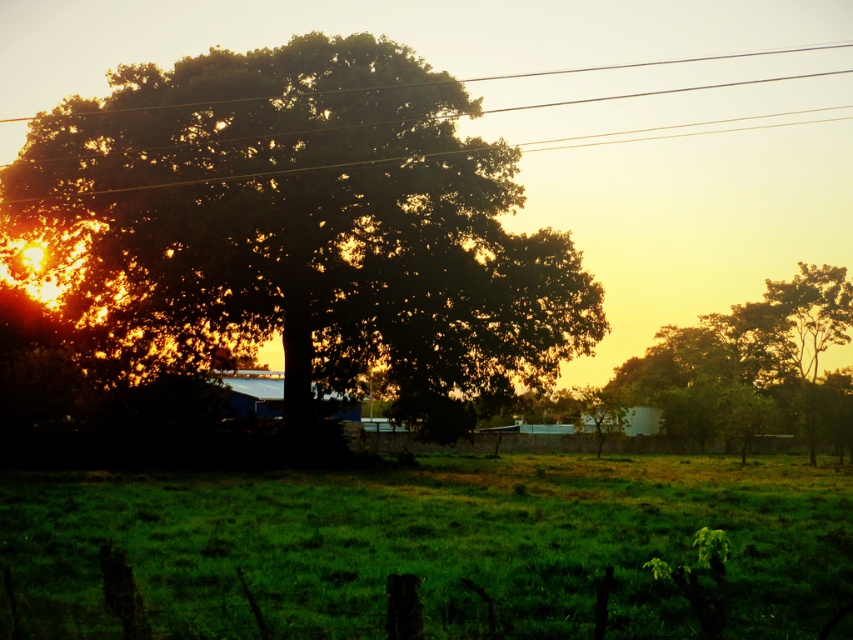
Question: Can you confirm if green grassy field at center is smaller than green leafy tree at right?

Choices:
 (A) no
 (B) yes

Answer: (B)

Question: Which of the following is the farthest from the observer?

Choices:
 (A) green leafy tree at center
 (B) green grassy field at center
 (C) metallic wires at upper center

Answer: (C)

Question: Can you confirm if green grassy field at center is positioned below metallic wires at upper center?

Choices:
 (A) no
 (B) yes

Answer: (B)

Question: Which object appears closest to the camera in this image?

Choices:
 (A) green grassy field at center
 (B) metallic wires at upper center

Answer: (A)

Question: Considering the real-world distances, which object is closest to the metallic wires at upper center?

Choices:
 (A) green leafy tree at right
 (B) green leafy tree at center
 (C) green grassy field at center

Answer: (B)

Question: Considering the relative positions of green grassy field at center and metallic wires at upper center in the image provided, where is green grassy field at center located with respect to metallic wires at upper center?

Choices:
 (A) below
 (B) above

Answer: (A)